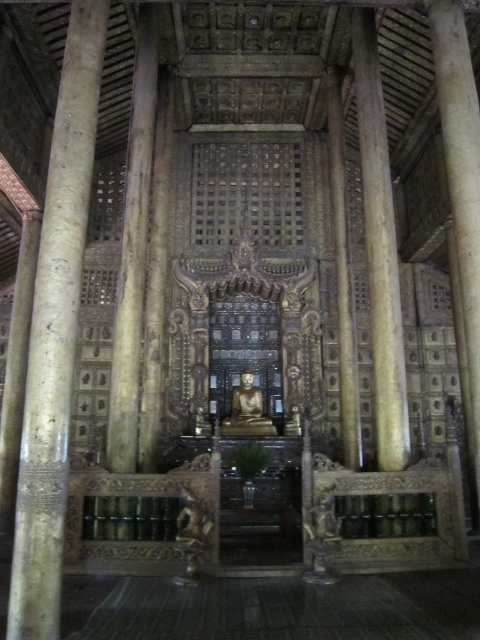
Is wooden carved column at center positioned behind carved wood pillar at center?

No, it is in front of carved wood pillar at center.

Which is behind, point (66, 83) or point (468, 182)?

Positioned behind is point (468, 182).

The width and height of the screenshot is (480, 640). What are the coordinates of `wooden carved column at center` in the screenshot? It's located at (56, 333).

At what (x,y) coordinates should I click in order to perform the action: click on wooden carved column at center. Please return your answer as a coordinate pair (x, y). Looking at the image, I should click on (56, 333).